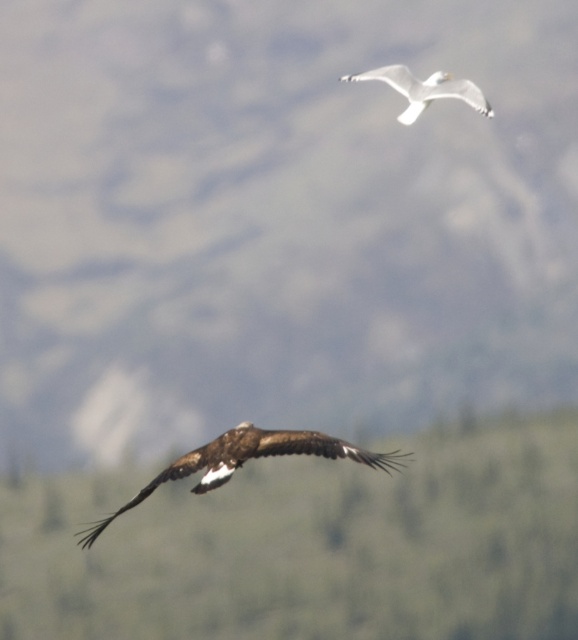
In order to click on brown feathered eagle at center in this screenshot , I will do `click(247, 458)`.

Looking at this image, is brown feathered eagle at center taller than white matte bird at upper center?

Yes.

Is point (213, 476) positioned before point (439, 97)?

Yes, it is.

Locate an element on the screen. brown feathered eagle at center is located at coordinates (247, 458).

Between point (379, 499) and point (201, 460), which one is positioned behind?

Point (379, 499)

Between point (301, 580) and point (249, 456), which one is positioned in front?

Point (249, 456) is in front.

Is point (421, 636) positioned after point (98, 531)?

Yes, point (421, 636) is behind point (98, 531).

Where is `brown textured tree at lower center`? brown textured tree at lower center is located at coordinates (310, 545).

Between brown textured tree at lower center and white matte bird at upper center, which one is positioned lower?

brown textured tree at lower center

Is brown textured tree at lower center thinner than white matte bird at upper center?

No, brown textured tree at lower center is not thinner than white matte bird at upper center.

Is point (431, 490) positioned behind point (475, 88)?

Yes, it is.

You are a GUI agent. You are given a task and a screenshot of the screen. Output one action in this format:
    pyautogui.click(x=<x>, y=<y>)
    Task: Click on the brown textured tree at lower center
    The image size is (578, 640).
    Given the screenshot: What is the action you would take?
    pyautogui.click(x=310, y=545)